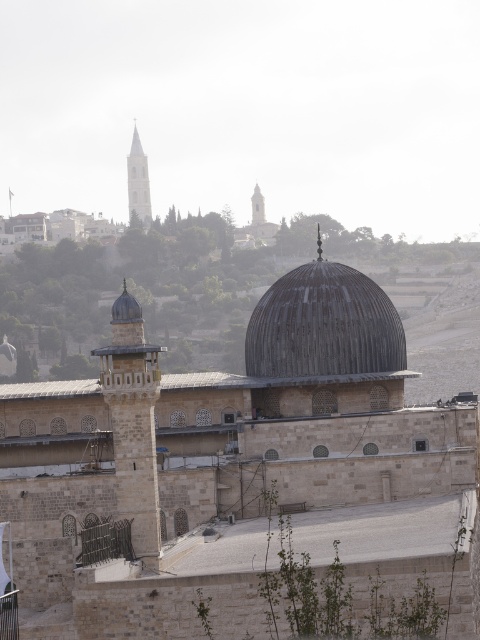
Question: Which point is farther from the camera taking this photo?

Choices:
 (A) (265, 220)
 (B) (373, 340)

Answer: (A)

Question: Is rusty metal dome at center smaller than smooth white tower at upper left?

Choices:
 (A) yes
 (B) no

Answer: (A)

Question: Is rusty metal dome at center below smooth stone minaret at center?

Choices:
 (A) yes
 (B) no

Answer: (A)

Question: Among these objects, which one is farthest from the camera?

Choices:
 (A) smooth white tower at upper left
 (B) smooth stone minaret at center
 (C) rusty metal dome at center

Answer: (B)

Question: Is rusty metal dome at center wider than smooth white tower at upper left?

Choices:
 (A) yes
 (B) no

Answer: (A)

Question: Which object is positioned farthest from the smooth stone minaret at center?

Choices:
 (A) smooth white tower at upper left
 (B) rusty metal dome at center

Answer: (B)